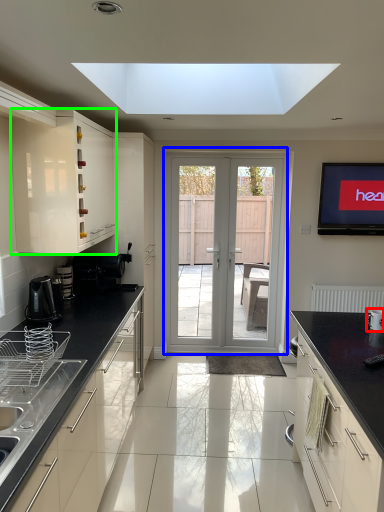
Question: Which object is positioned closest to appliance (highlighted by a red box)? Select from door (highlighted by a blue box) and cabinetry (highlighted by a green box).

Choices:
 (A) door
 (B) cabinetry

Answer: (B)